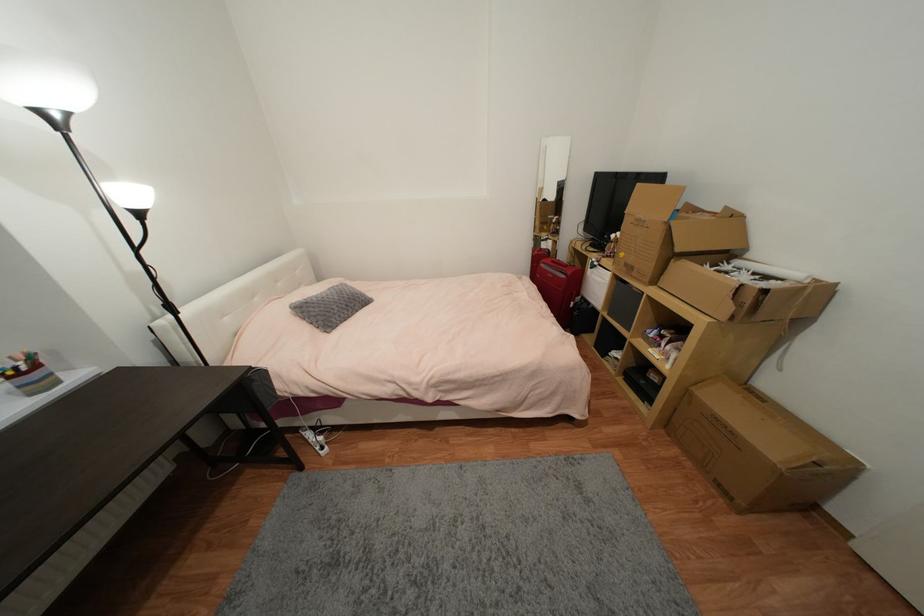
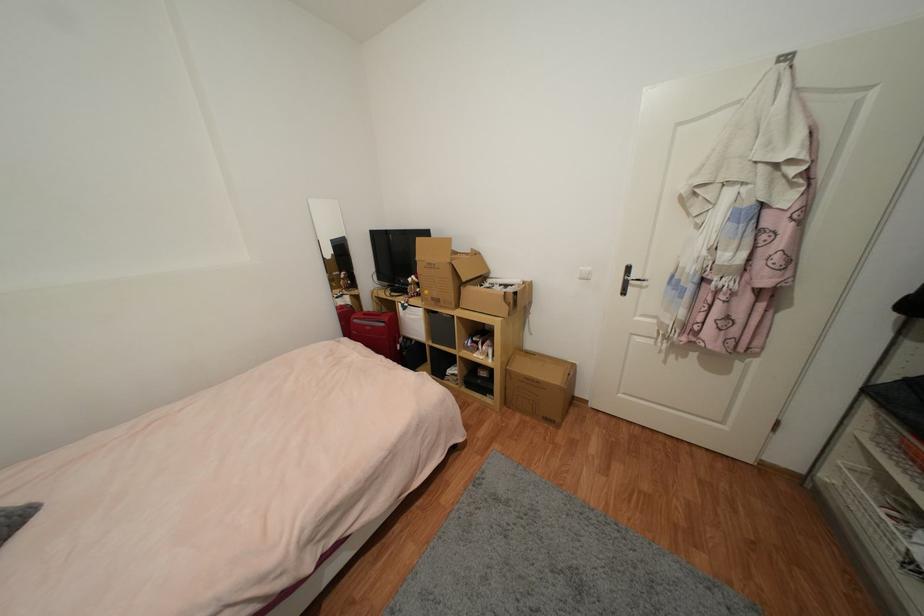
Question: The first image is from the beginning of the video and the second image is from the end. How did the camera likely rotate when shooting the video?

Choices:
 (A) Left
 (B) Right
 (C) Up
 (D) Down

Answer: (B)